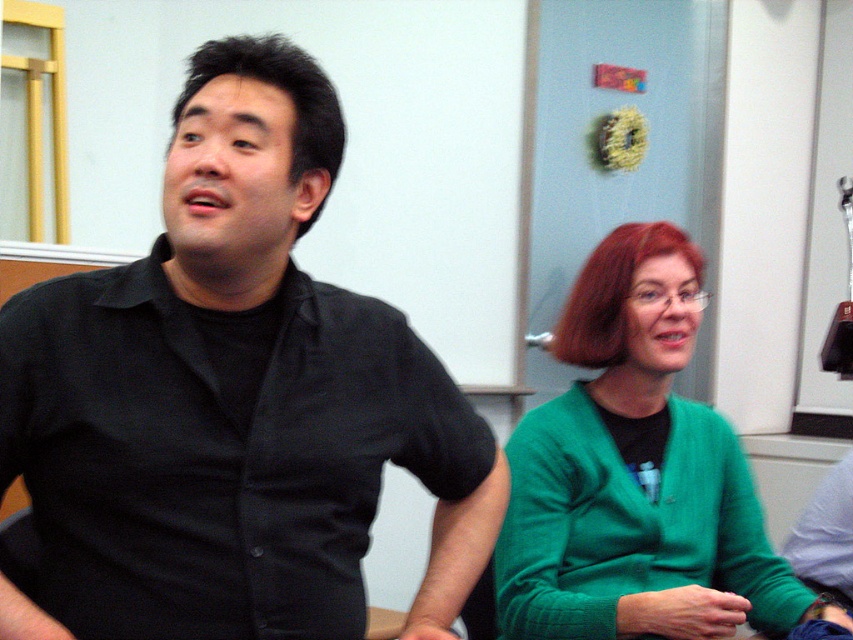
You are standing in the room and want to hand a document to the person wearing the black matte shirt at left. If the document is 12 inches long, can you reach them without moving closer than 3 feet?

The black matte shirt at left is 39.13 inches away from the viewer. Since 3 feet equals 36 inches, the distance is slightly more than 3 feet. The document is 12 inches long, so if extended fully, it might just reach the person. However, it would be tight. It is advisable to move a bit closer for safety.

You are designing a seating arrangement for a meeting where both the black matte shirt at left and the green sweater at center will be present. Considering their sizes, which of the two requires a wider seat?

The black matte shirt at left requires a wider seat because its width is larger than the green sweater at center.

From the picture: You are standing in the room and want to locate the black matte shirt at left. Can you tell me its approximate 2D coordinates in the image?

The 2D location of black matte shirt at left is at point (231, 400).